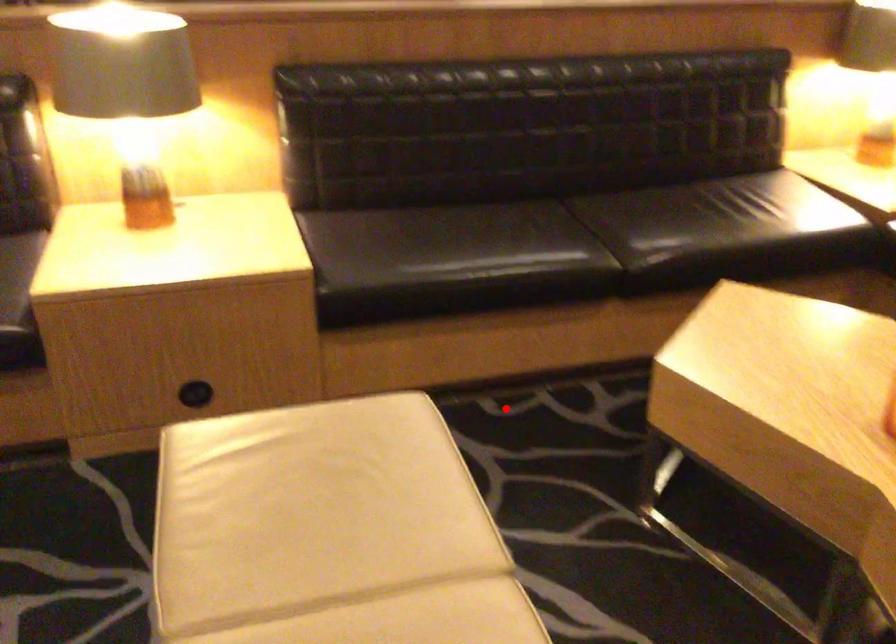
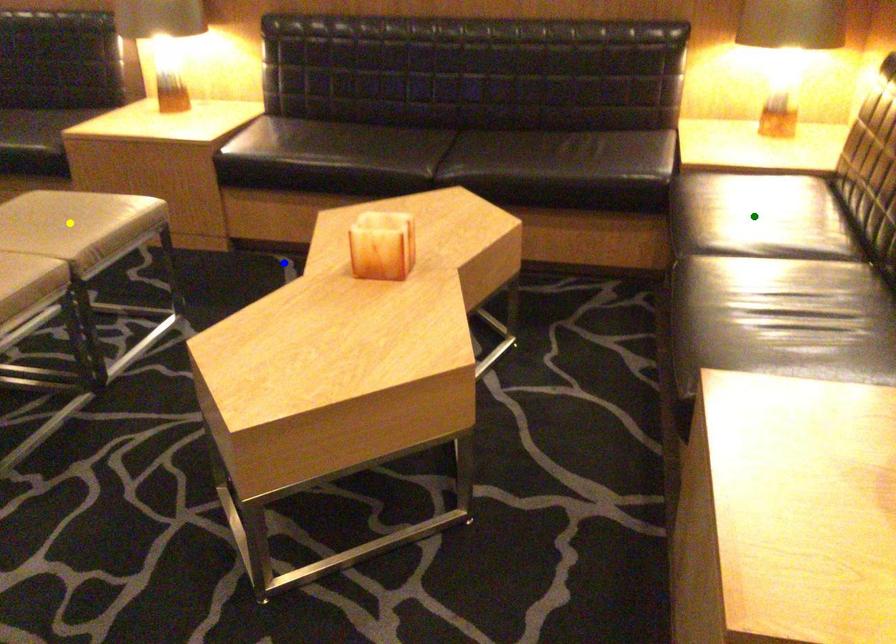
Question: I am providing you with two images of the same scene from different viewpoints. A red point is marked on the first image. You are given multiple points on the second image. Which point in image 2 represents the same 3d spot as the red point in image 1?

Choices:
 (A) blue point
 (B) green point
 (C) yellow point

Answer: (A)